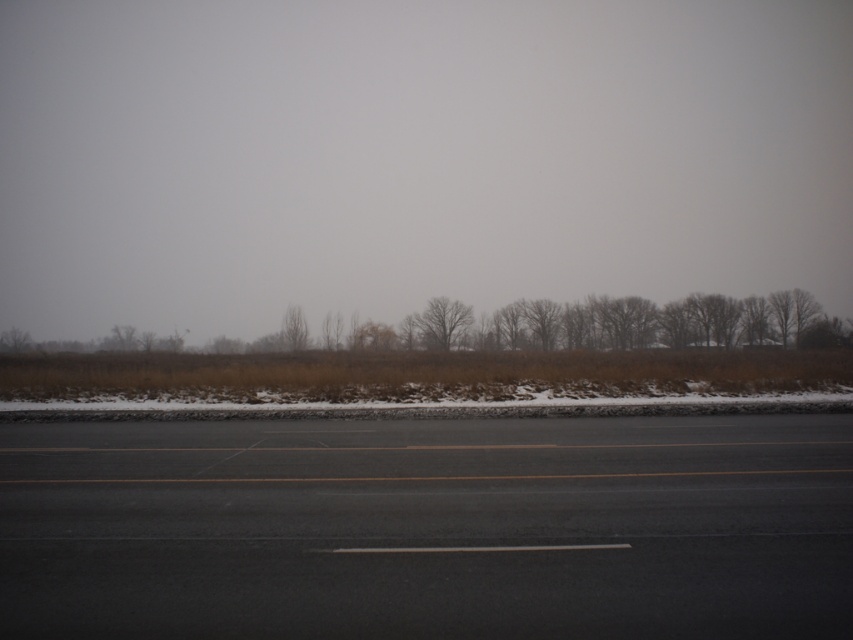
Question: Which of the following is the closest to the observer?

Choices:
 (A) foggy atmosphere at upper center
 (B) brown matte trees at center

Answer: (B)

Question: Which object is positioned closest to the brown matte trees at center?

Choices:
 (A) bare branches at center
 (B) black asphalt highway at center
 (C) brown matte tree at center

Answer: (C)

Question: Which point is closer to the camera taking this photo?

Choices:
 (A) (457, 312)
 (B) (236, 566)
 (C) (178, 344)
 (D) (242, 19)

Answer: (B)

Question: Is black asphalt highway at center bigger than brown matte trees at center?

Choices:
 (A) yes
 (B) no

Answer: (B)

Question: Can you confirm if brown matte trees at center is positioned above bare branches at center?

Choices:
 (A) no
 (B) yes

Answer: (A)

Question: Is black asphalt highway at center wider than brown matte tree at center?

Choices:
 (A) no
 (B) yes

Answer: (B)